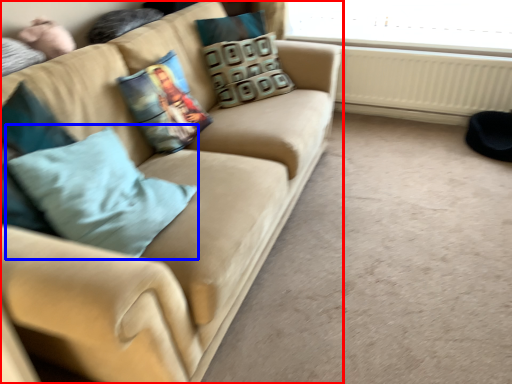
Question: Which object appears farthest to the camera in this image, studio couch (highlighted by a red box) or throw pillow (highlighted by a blue box)?

Choices:
 (A) studio couch
 (B) throw pillow

Answer: (B)